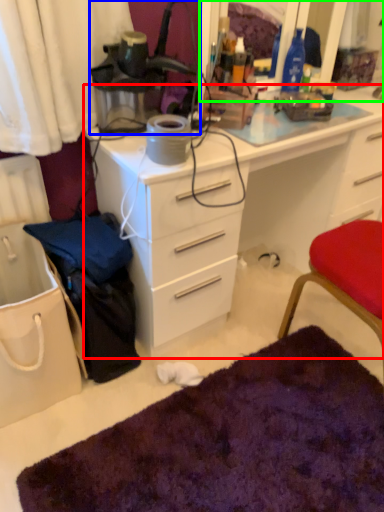
Question: Which object is the farthest from desk (highlighted by a red box)? Choose among these: lamp (highlighted by a blue box) or mirror (highlighted by a green box).

Choices:
 (A) lamp
 (B) mirror

Answer: (B)